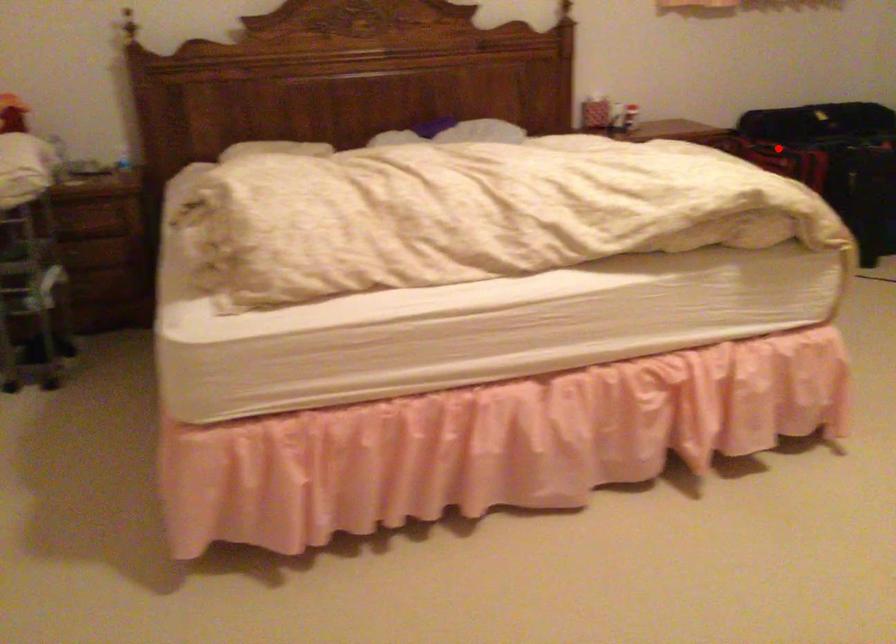
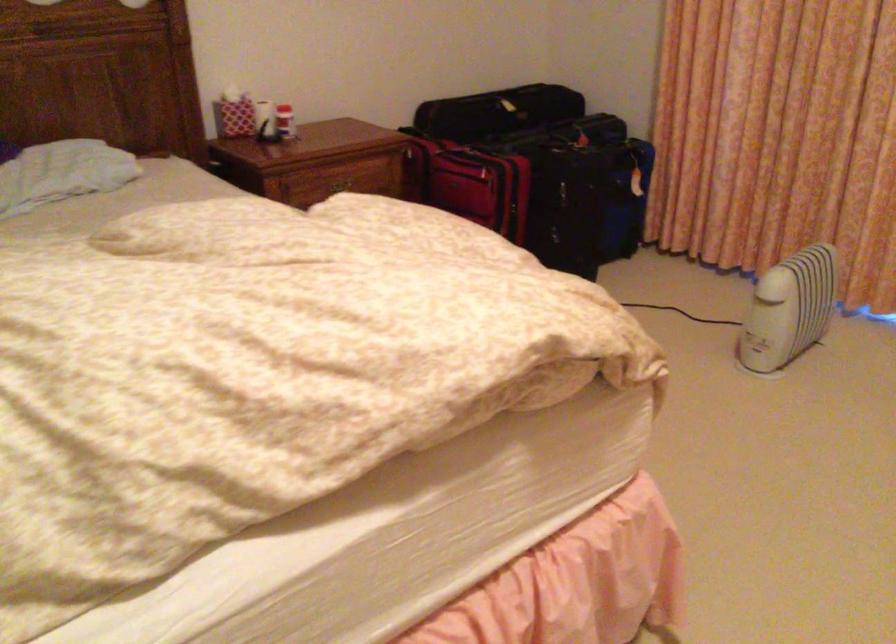
The point at the highlighted location is marked in the first image. Where is the corresponding point in the second image?

(469, 183)